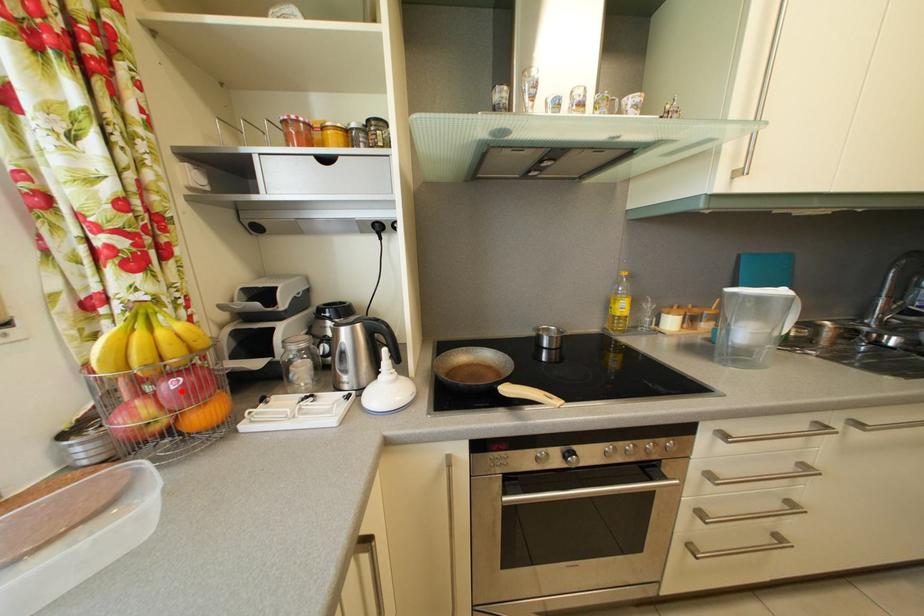
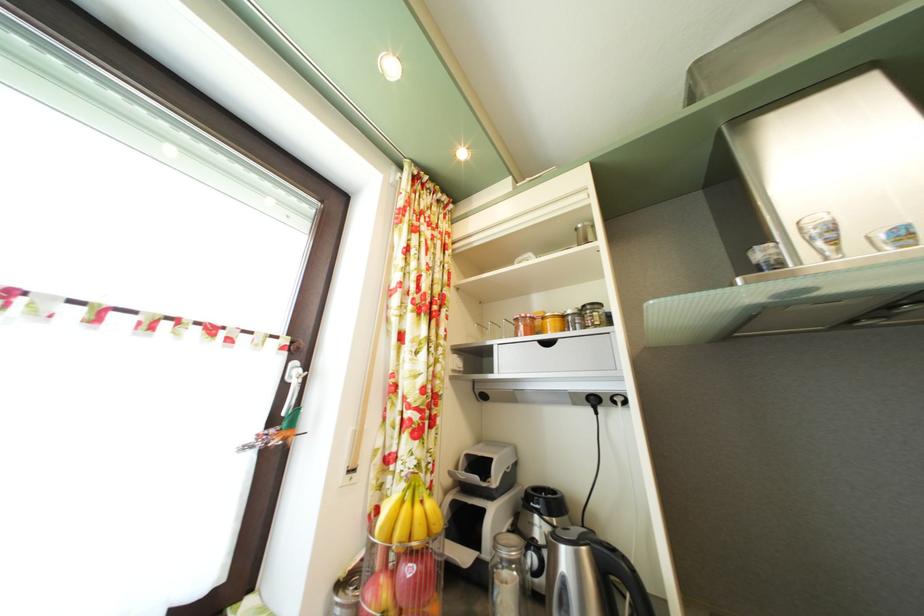
Where in the second image is the point corresponding to the highlighted location from the first image?

(418, 578)